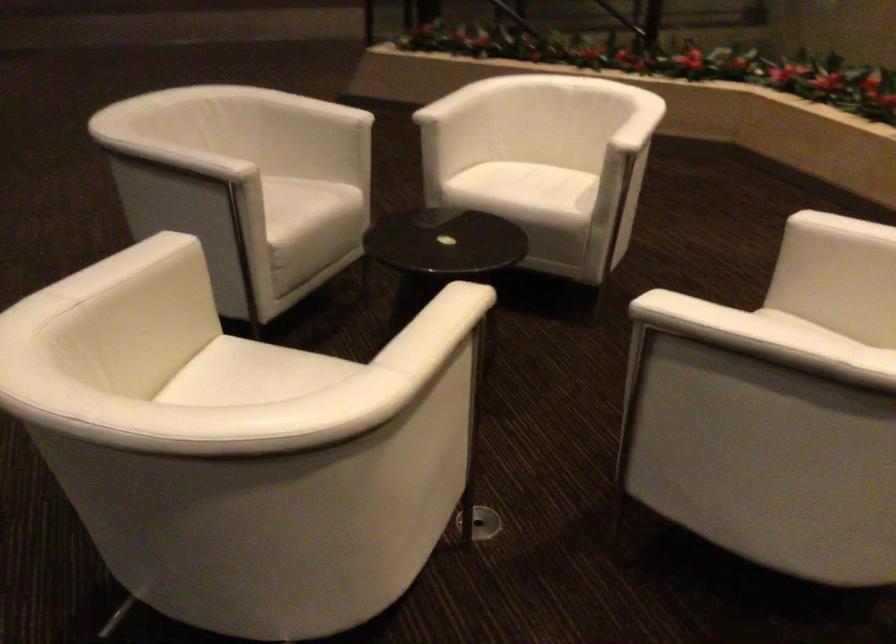
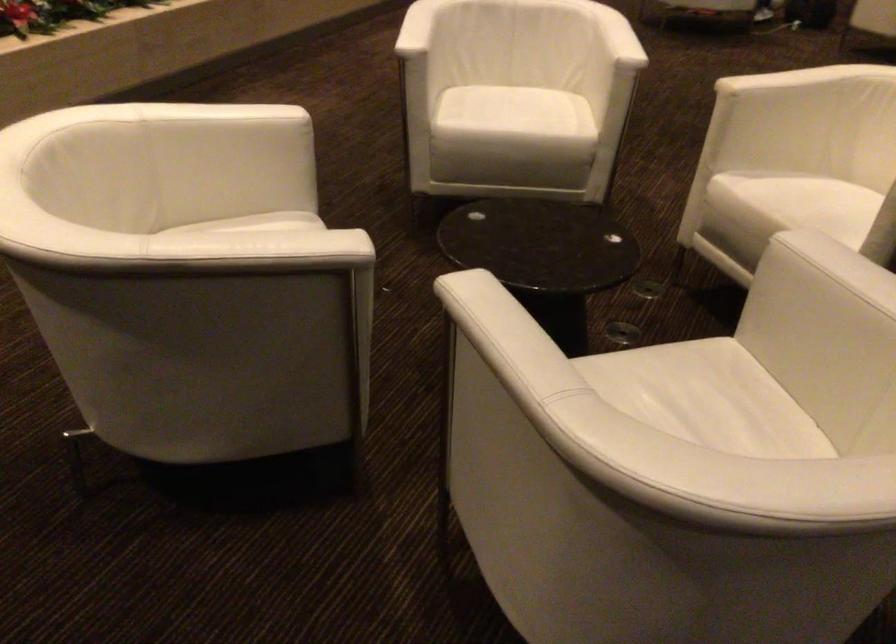
Where in the second image is the point corresponding to (718,305) from the first image?

(617, 37)